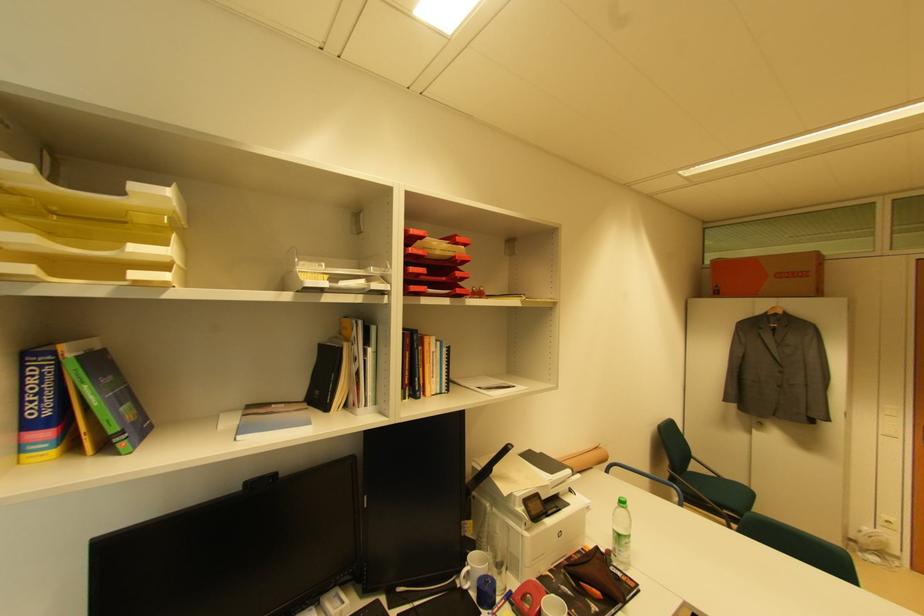
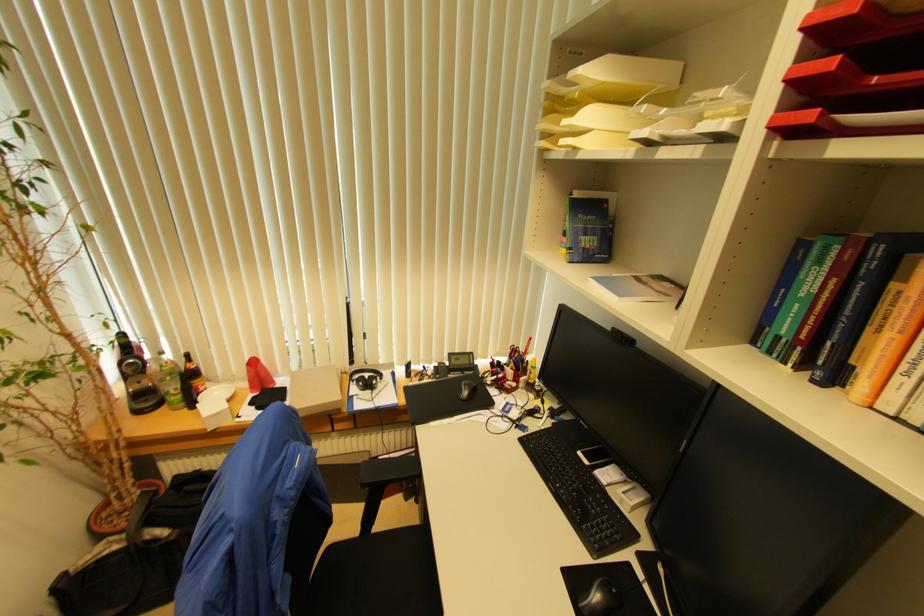
Based on the continuous images, in which direction is the camera rotating?

The camera rotated toward left-down.